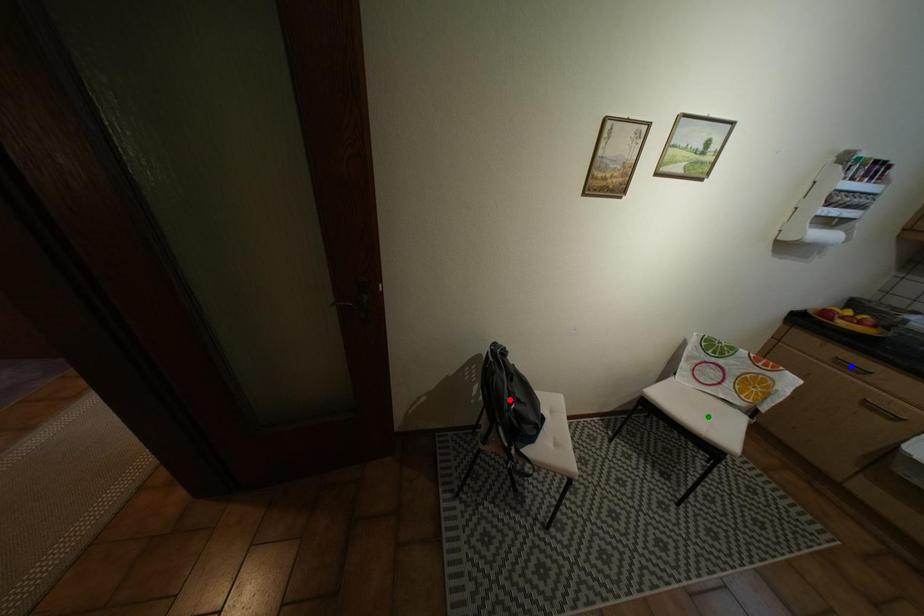
Order these from nearest to farthest:
1. blue point
2. red point
3. green point

1. red point
2. blue point
3. green point